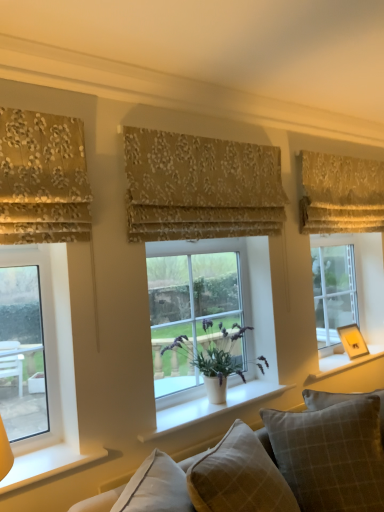
Find the location of a particular element. The image size is (384, 512). vacant area on top of white smooth window sill at lower left, the 3th window sill viewed from the back (from a real-world perspective) is located at coordinates (43, 460).